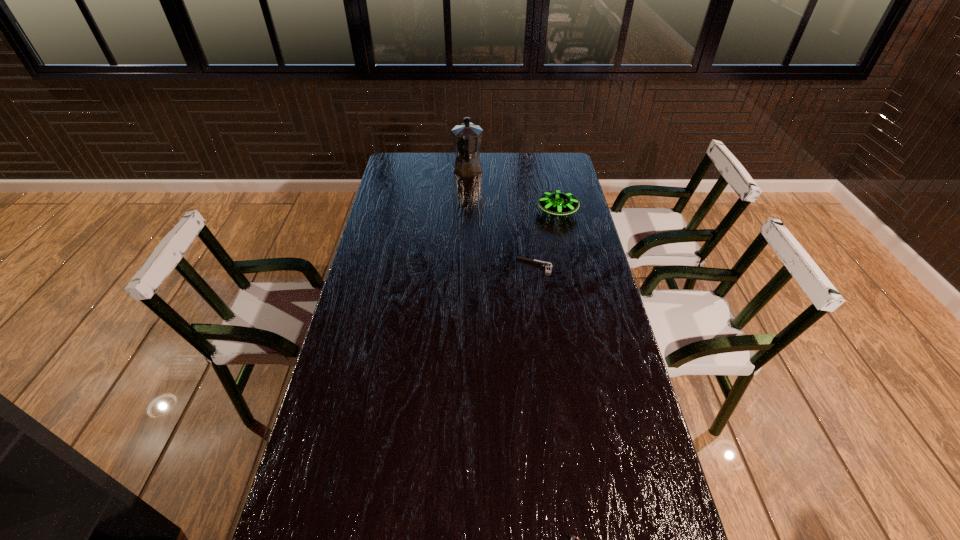
The height and width of the screenshot is (540, 960). I want to click on free spot between the farthest object and the third nearest object, so click(513, 192).

Identify the location of free point between the pistol and the second farthest object. This screenshot has width=960, height=540. (546, 238).

Where is `free space between the second tallest object and the second nearest object`? The image size is (960, 540). free space between the second tallest object and the second nearest object is located at coordinates (546, 238).

Find the location of a particular element. The width and height of the screenshot is (960, 540). object that ranks as the second closest to the nearest object is located at coordinates (556, 202).

Where is `object that is the third closest to the second farthest object`? This screenshot has width=960, height=540. object that is the third closest to the second farthest object is located at coordinates (572, 537).

This screenshot has height=540, width=960. Find the location of `blank space that satisfies the following two spatial constraints: 1. on the front side of the second farthest object; 2. on the front-facing side of the shortest object`. blank space that satisfies the following two spatial constraints: 1. on the front side of the second farthest object; 2. on the front-facing side of the shortest object is located at coordinates (569, 265).